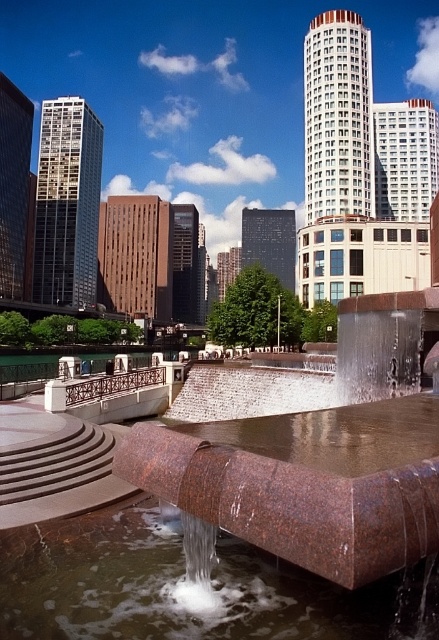
Question: Considering the relative positions of rustic stone fountain at center and brown granite water at center in the image provided, where is rustic stone fountain at center located with respect to brown granite water at center?

Choices:
 (A) above
 (B) below

Answer: (A)

Question: Which object is closer to the camera taking this photo?

Choices:
 (A) rustic stone fountain at center
 (B) brown granite water at center

Answer: (A)

Question: Which point appears farthest from the camera in this image?

Choices:
 (A) (198, 620)
 (B) (169, 432)

Answer: (B)

Question: Which point is farther to the camera?

Choices:
 (A) brown granite water at center
 (B) rustic stone fountain at center

Answer: (A)

Question: Does rustic stone fountain at center have a greater width compared to brown granite water at center?

Choices:
 (A) yes
 (B) no

Answer: (A)

Question: Can you confirm if rustic stone fountain at center is positioned below brown granite water at center?

Choices:
 (A) yes
 (B) no

Answer: (B)